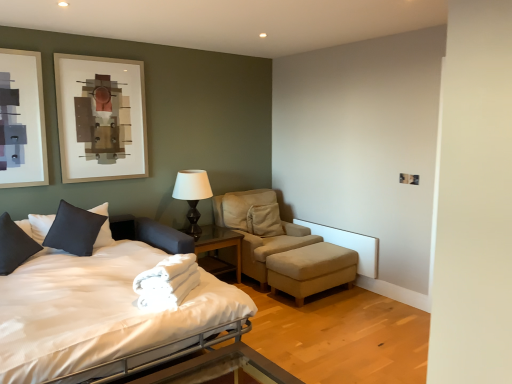
Question: Is the surface of glass/metal nightstand at center in direct contact with metallic silver bed frame at lower center?

Choices:
 (A) no
 (B) yes

Answer: (A)

Question: Is glass/metal nightstand at center to the right of metallic silver bed frame at lower center from the viewer's perspective?

Choices:
 (A) yes
 (B) no

Answer: (B)

Question: From a real-world perspective, does glass/metal nightstand at center sit lower than metallic silver bed frame at lower center?

Choices:
 (A) yes
 (B) no

Answer: (A)

Question: Considering the relative sizes of glass/metal nightstand at center and metallic silver bed frame at lower center in the image provided, is glass/metal nightstand at center smaller than metallic silver bed frame at lower center?

Choices:
 (A) yes
 (B) no

Answer: (B)

Question: Is glass/metal nightstand at center positioned before metallic silver bed frame at lower center?

Choices:
 (A) yes
 (B) no

Answer: (B)

Question: Is matte black table lamp at center inside or outside of metallic silver bed frame at lower center?

Choices:
 (A) inside
 (B) outside

Answer: (B)

Question: Does point (185, 178) appear closer or farther from the camera than point (144, 380)?

Choices:
 (A) farther
 (B) closer

Answer: (A)

Question: In terms of height, does matte black table lamp at center look taller or shorter compared to metallic silver bed frame at lower center?

Choices:
 (A) short
 (B) tall

Answer: (B)

Question: Considering the positions of matte black table lamp at center and metallic silver bed frame at lower center in the image, is matte black table lamp at center bigger or smaller than metallic silver bed frame at lower center?

Choices:
 (A) small
 (B) big

Answer: (A)

Question: Considering their positions, is beige fabric ottoman at lower right located in front of or behind dark gray fabric pillow at left, the 2th pillow in the left-to-right sequence?

Choices:
 (A) front
 (B) behind

Answer: (B)

Question: From a real-world perspective, is beige fabric ottoman at lower right positioned above or below dark gray fabric pillow at left, which is counted as the 1th pillow, starting from the right?

Choices:
 (A) below
 (B) above

Answer: (A)

Question: From the image's perspective, relative to dark gray fabric pillow at left, the 2th pillow in the left-to-right sequence, is beige fabric ottoman at lower right above or below?

Choices:
 (A) above
 (B) below

Answer: (B)

Question: Based on their sizes in the image, would you say beige fabric ottoman at lower right is bigger or smaller than dark gray fabric pillow at left, which is counted as the 1th pillow, starting from the right?

Choices:
 (A) big
 (B) small

Answer: (A)

Question: From their relative heights in the image, would you say metallic silver bed frame at lower center is taller or shorter than beige fabric ottoman at lower right?

Choices:
 (A) tall
 (B) short

Answer: (B)

Question: Does point (238, 357) appear closer or farther from the camera than point (316, 266)?

Choices:
 (A) farther
 (B) closer

Answer: (B)